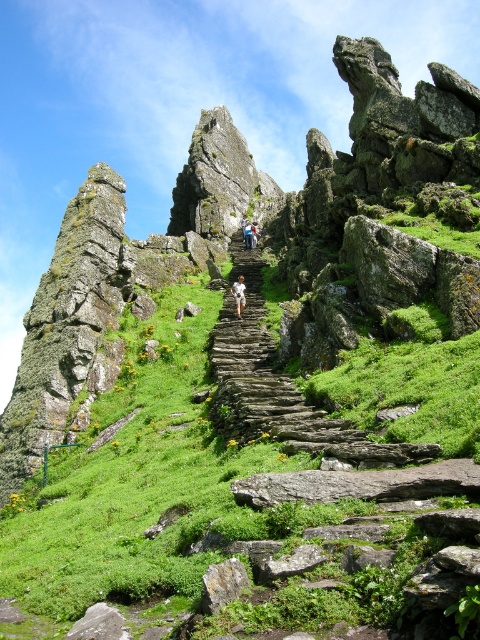
Question: From the image, what is the correct spatial relationship of green mossy stairs at center in relation to light brown leather jacket at center?

Choices:
 (A) above
 (B) below

Answer: (B)

Question: Which object is closer to the camera taking this photo?

Choices:
 (A) light brown leather jacket at center
 (B) green mossy stairs at center

Answer: (B)

Question: Does rustic stone stairs at center have a larger size compared to light brown leather jacket at center?

Choices:
 (A) yes
 (B) no

Answer: (A)

Question: Observing the image, what is the correct spatial positioning of green mossy stairs at center in reference to rustic stone stairs at center?

Choices:
 (A) below
 (B) above

Answer: (A)

Question: Which object appears closest to the camera in this image?

Choices:
 (A) light brown leather jacket at center
 (B) rustic stone stairs at center

Answer: (B)

Question: Based on their relative distances, which object is farther from the rustic stone stairs at center?

Choices:
 (A) light brown leather jacket at center
 (B) green mossy stairs at center

Answer: (A)